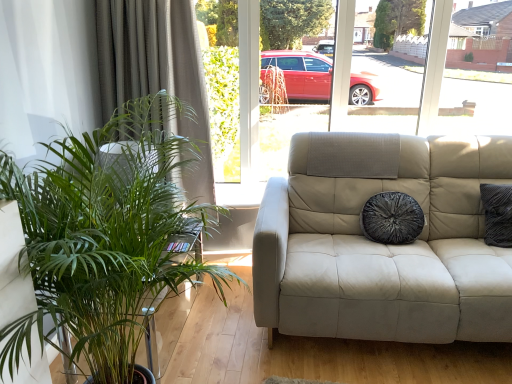
Question: From a real-world perspective, is velvety black pillow at center over green fabric curtain at left?

Choices:
 (A) yes
 (B) no

Answer: (B)

Question: Does velvety black pillow at center come in front of green fabric curtain at left?

Choices:
 (A) no
 (B) yes

Answer: (B)

Question: Is velvety black pillow at center looking in the opposite direction of green fabric curtain at left?

Choices:
 (A) no
 (B) yes

Answer: (A)

Question: Can you confirm if velvety black pillow at center is smaller than green fabric curtain at left?

Choices:
 (A) no
 (B) yes

Answer: (B)

Question: Considering the relative sizes of velvety black pillow at center and green fabric curtain at left in the image provided, is velvety black pillow at center thinner than green fabric curtain at left?

Choices:
 (A) yes
 (B) no

Answer: (A)

Question: Based on their positions, is velvety black pillow at center located to the left or right of green fabric curtain at left?

Choices:
 (A) left
 (B) right

Answer: (B)

Question: From a real-world perspective, is velvety black pillow at center above or below green fabric curtain at left?

Choices:
 (A) below
 (B) above

Answer: (A)

Question: Considering the positions of point (381, 230) and point (208, 144), is point (381, 230) closer or farther from the camera than point (208, 144)?

Choices:
 (A) farther
 (B) closer

Answer: (B)

Question: In terms of size, does velvety black pillow at center appear bigger or smaller than green fabric curtain at left?

Choices:
 (A) small
 (B) big

Answer: (A)

Question: Considering the positions of point (111, 205) and point (223, 243), is point (111, 205) closer or farther from the camera than point (223, 243)?

Choices:
 (A) farther
 (B) closer

Answer: (B)

Question: Choose the correct answer: Is green leafy plant at left inside green fabric curtain at left or outside it?

Choices:
 (A) outside
 (B) inside

Answer: (A)

Question: From a real-world perspective, is green leafy plant at left physically located above or below green fabric curtain at left?

Choices:
 (A) above
 (B) below

Answer: (B)

Question: Visually, is green leafy plant at left positioned to the left or to the right of green fabric curtain at left?

Choices:
 (A) left
 (B) right

Answer: (B)

Question: Looking at the image, does velvety black pillow at center seem bigger or smaller compared to green leafy plant at left?

Choices:
 (A) small
 (B) big

Answer: (A)

Question: Is point (414, 210) closer or farther from the camera than point (175, 158)?

Choices:
 (A) farther
 (B) closer

Answer: (A)